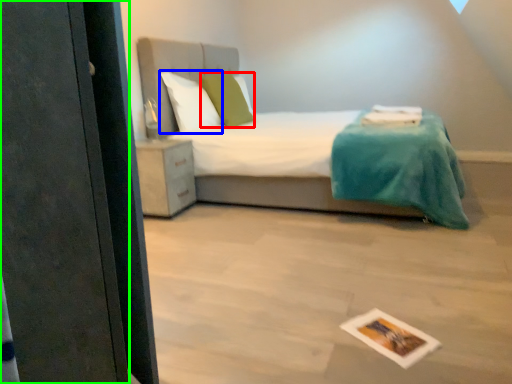
Question: Which object is positioned farthest from pillow (highlighted by a red box)? Select from pillow (highlighted by a blue box) and screen door (highlighted by a green box).

Choices:
 (A) pillow
 (B) screen door

Answer: (B)